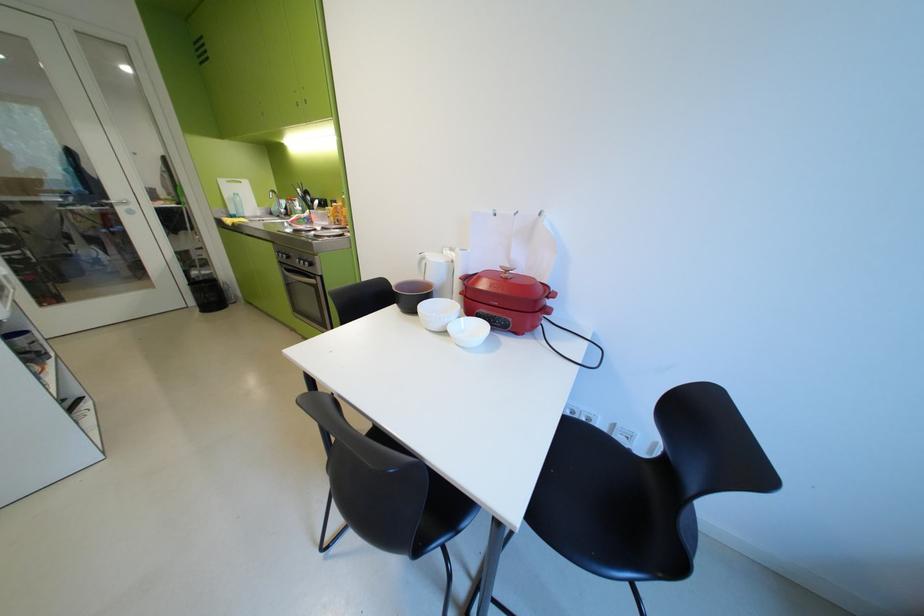
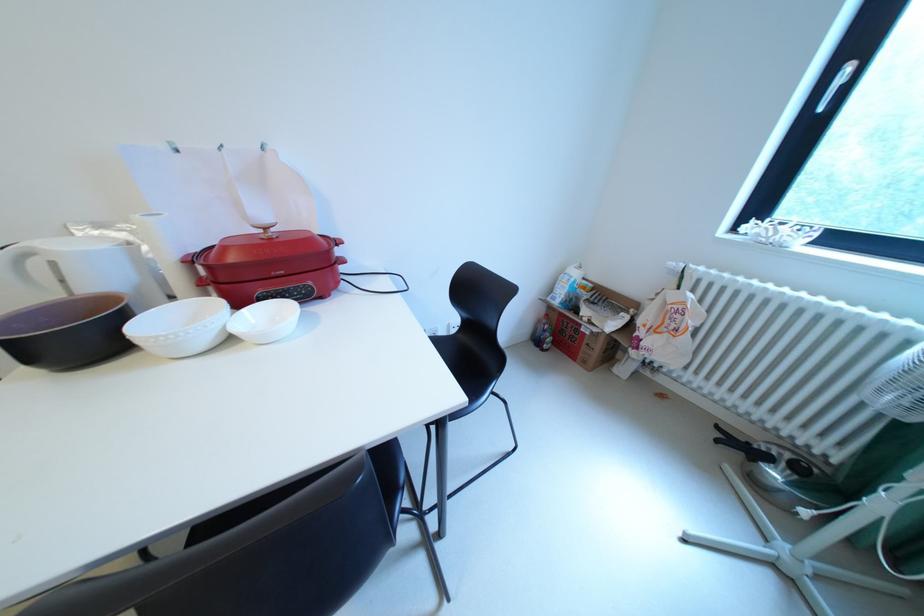
The point at (454, 310) is marked in the first image. Where is the corresponding point in the second image?

(193, 321)